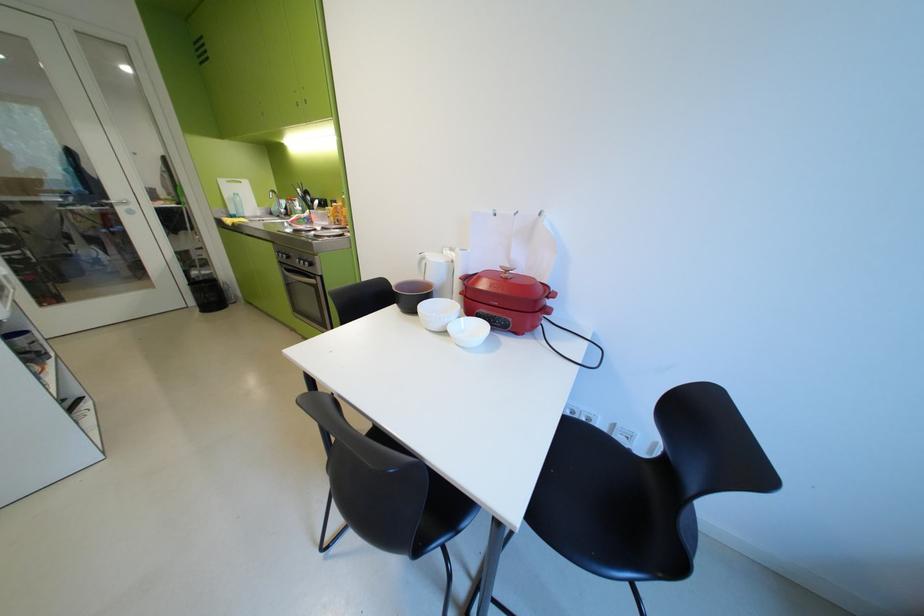
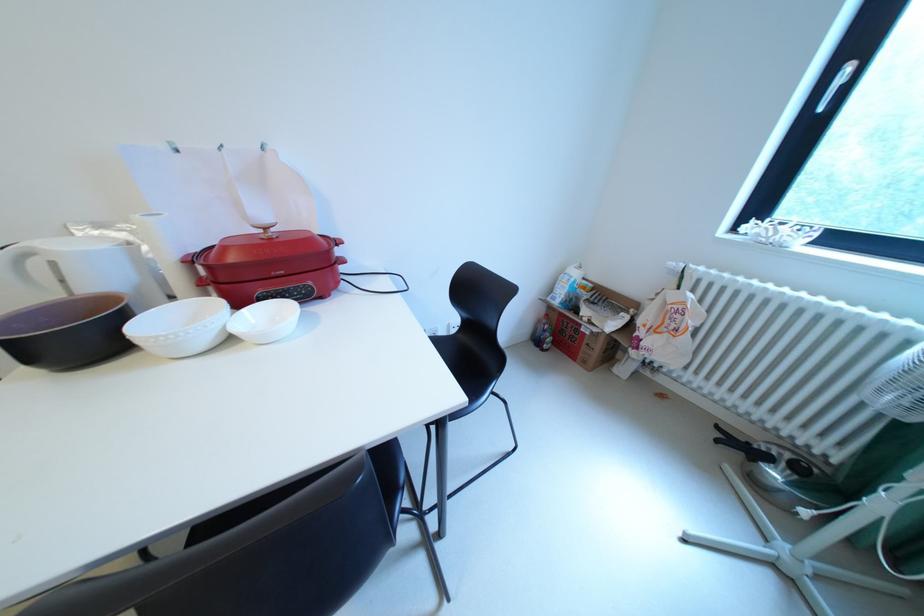
The point at (454, 310) is marked in the first image. Where is the corresponding point in the second image?

(193, 321)